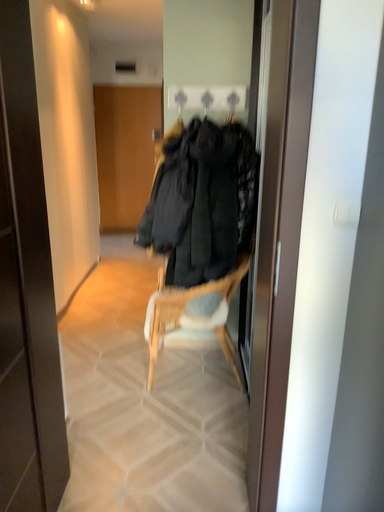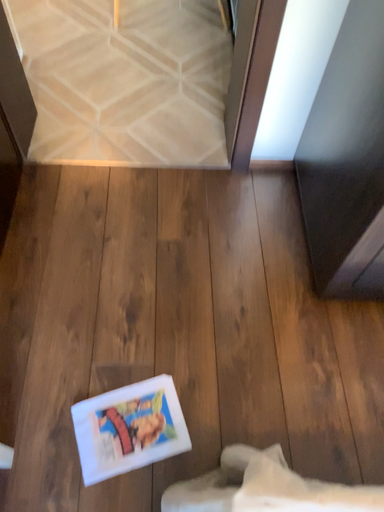
Question: How did the camera likely rotate when shooting the video?

Choices:
 (A) rotated upward
 (B) rotated downward

Answer: (B)